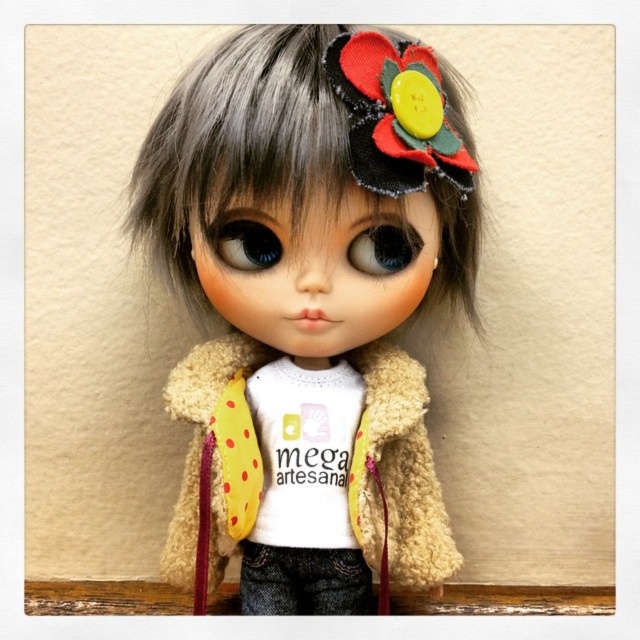
Question: From the image, what is the correct spatial relationship of yellow polka dot fabric at center in relation to wooden ledge at lower center?

Choices:
 (A) right
 (B) left

Answer: (A)

Question: Which of the following is the closest to the observer?

Choices:
 (A) fuzzy beige coat at center
 (B) yellow polka dot fabric at center
 (C) wooden ledge at lower center

Answer: (A)

Question: Among these objects, which one is nearest to the camera?

Choices:
 (A) yellow polka dot fabric at center
 (B) white fabric shirt at center
 (C) wooden ledge at lower center
 (D) fuzzy beige coat at center

Answer: (D)

Question: Can you confirm if fuzzy beige coat at center is positioned below white fabric shirt at center?

Choices:
 (A) no
 (B) yes

Answer: (A)

Question: Can you confirm if yellow polka dot fabric at center is positioned above wooden ledge at lower center?

Choices:
 (A) no
 (B) yes

Answer: (B)

Question: Which of these objects is positioned closest to the white fabric shirt at center?

Choices:
 (A) yellow polka dot fabric at center
 (B) wooden ledge at lower center

Answer: (A)